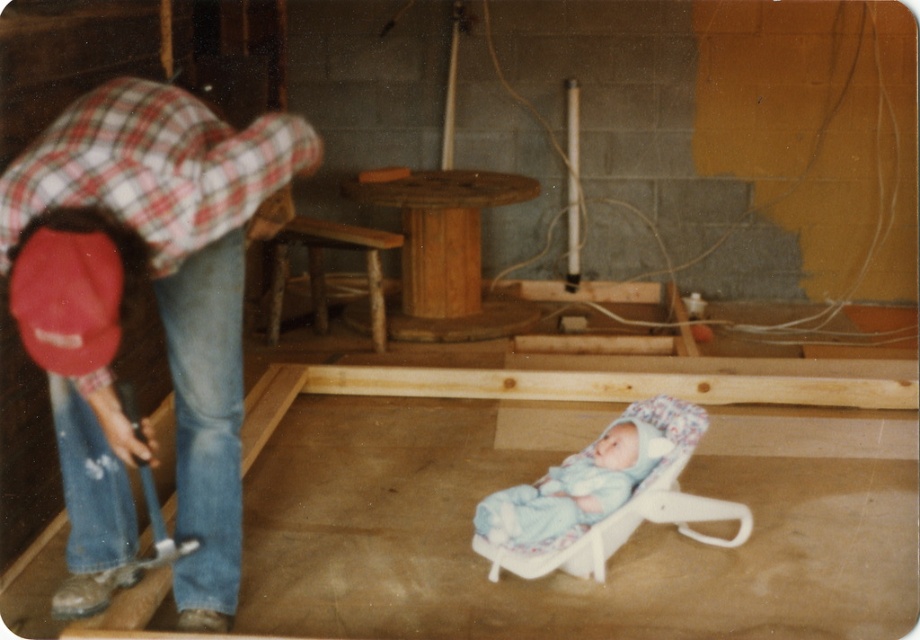
You are a construction worker standing near the wooden floor frame in the basement. You need to hand a tool to a colleague wearing the red plaid shirt at left. If you are 1.57 meters apart, can you reach them without moving closer if your maximum reaching distance is 1.5 meters?

The red plaid shirt at left is 1.57 meters away from the viewer, which is slightly beyond the maximum reaching distance of 1.5 meters. Therefore, you cannot reach them without moving closer.

You are standing in the construction site of the basement and want to know which of the two points, point (x=203, y=225) or point (x=314, y=269), is closer to you. Can you determine this based on the given information?

Point (x=203, y=225) is closer to the camera than point (x=314, y=269), so it is closer to you.

You are a contractor inspecting the construction site. You see the blue soft fabric newborn at center and the wooden rustic chair at center. Which object is located to the right of the other?

The blue soft fabric newborn at center is positioned on the right side of wooden rustic chair at center, so the blue soft fabric newborn at center is to the right of the wooden rustic chair at center.